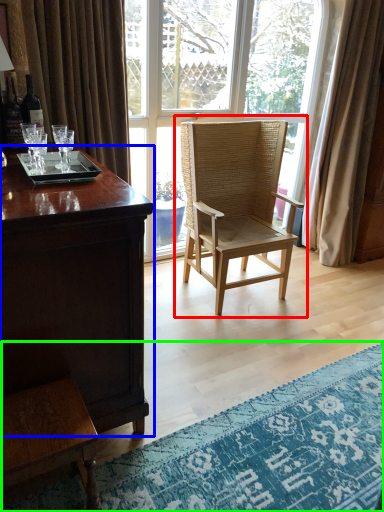
Question: Which object is the closest to the chair (highlighted by a red box)? Choose among these: desk (highlighted by a blue box) or mat (highlighted by a green box).

Choices:
 (A) desk
 (B) mat

Answer: (B)